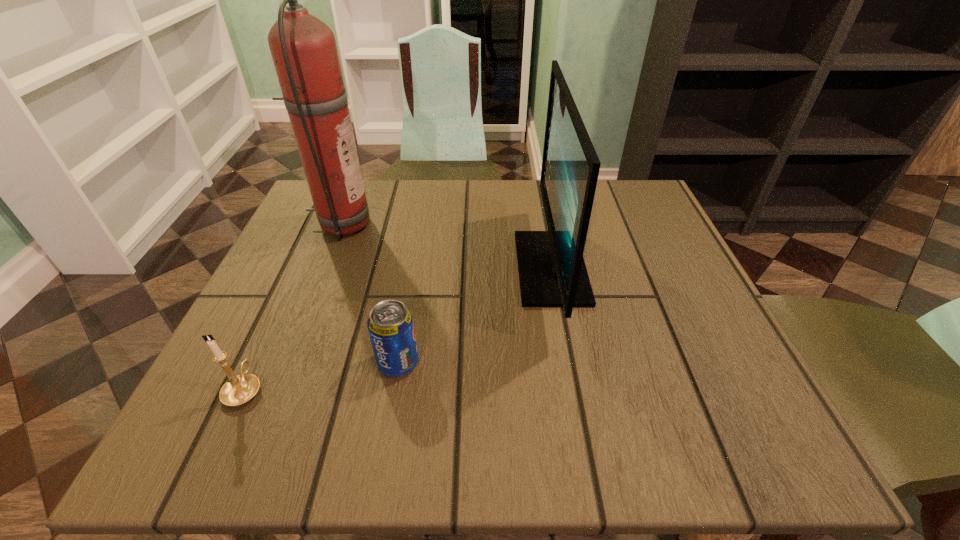
The height and width of the screenshot is (540, 960). What are the coordinates of `free space between the candle holder and the fire extinguisher` in the screenshot? It's located at (293, 307).

At what (x,y) coordinates should I click in order to perform the action: click on free space between the fire extinguisher and the monitor. Please return your answer as a coordinate pair (x, y). Image resolution: width=960 pixels, height=540 pixels. Looking at the image, I should click on (446, 246).

In order to click on free spot between the soda and the second tallest object in this screenshot , I will do `click(474, 315)`.

This screenshot has height=540, width=960. Find the location of `free space that is in between the candle holder and the second object from right to left`. free space that is in between the candle holder and the second object from right to left is located at coordinates (322, 376).

Identify the location of the second closest object to the monitor. (303, 48).

Locate an element on the screen. Image resolution: width=960 pixels, height=540 pixels. object that is the second closest one to the soda is located at coordinates (552, 273).

Locate an element on the screen. vacant region that satisfies the following two spatial constraints: 1. on the handle side of the second object from right to left; 2. on the right side of the candle holder is located at coordinates (256, 363).

In order to click on blank space that satisfies the following two spatial constraints: 1. on the handle side of the candle holder; 2. on the left side of the second object from right to left in this screenshot , I will do `click(256, 363)`.

You are a GUI agent. You are given a task and a screenshot of the screen. Output one action in this format:
    pyautogui.click(x=<x>, y=<y>)
    Task: Click on the free space that satisfies the following two spatial constraints: 1. on the handle side of the soda; 2. on the left side of the candle holder
    
    Given the screenshot: What is the action you would take?
    pyautogui.click(x=256, y=363)

Identify the location of vacant space that satisfies the following two spatial constraints: 1. on the side of the soda with the label and nozzle; 2. on the left side of the fire extinguisher. This screenshot has width=960, height=540. (285, 363).